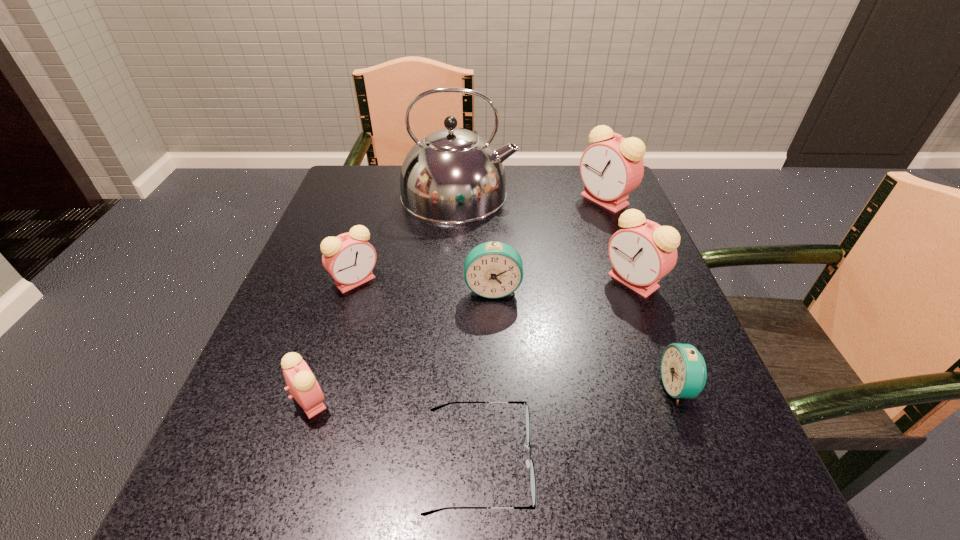
Locate an element on the screen. vacant region that satisfies the following two spatial constraints: 1. on the front-facing side of the third alarm clock from left to right; 2. on the lenses of the black spectacles is located at coordinates (498, 462).

Where is `blank area in the image that satisfies the following two spatial constraints: 1. on the face of the farthest pink alarm clock; 2. on the face of the second smallest pink alarm clock`? blank area in the image that satisfies the following two spatial constraints: 1. on the face of the farthest pink alarm clock; 2. on the face of the second smallest pink alarm clock is located at coordinates (636, 281).

This screenshot has height=540, width=960. I want to click on vacant space that satisfies the following two spatial constraints: 1. on the face of the second smallest pink alarm clock; 2. on the face of the smallest pink alarm clock, so [x=318, y=401].